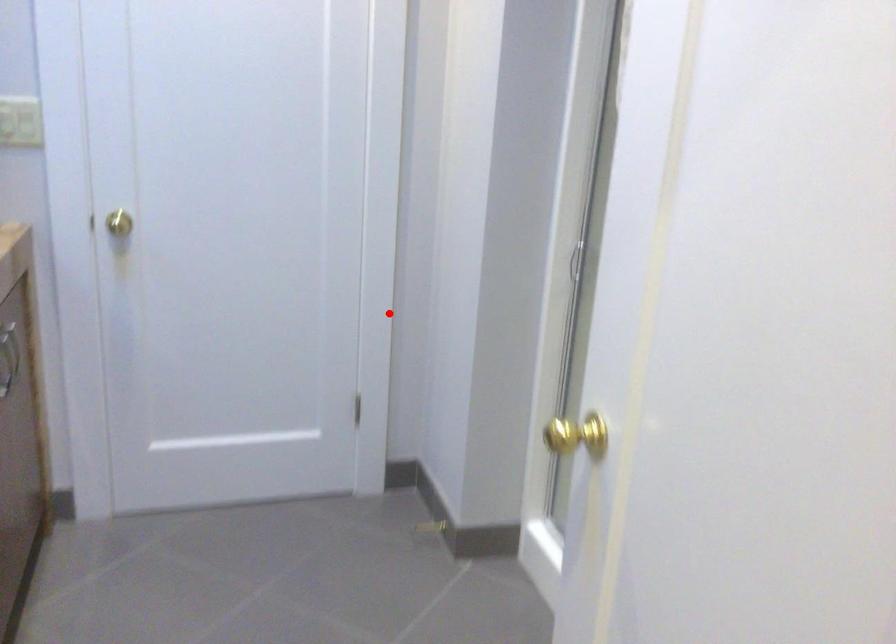
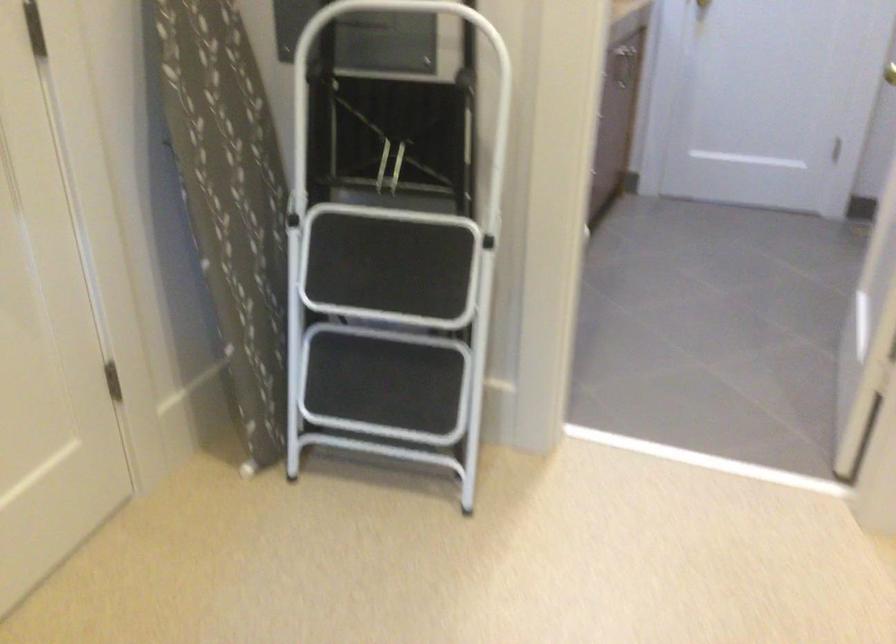
Locate, in the second image, the point that corresponds to the highlighted location in the first image.

(890, 73)